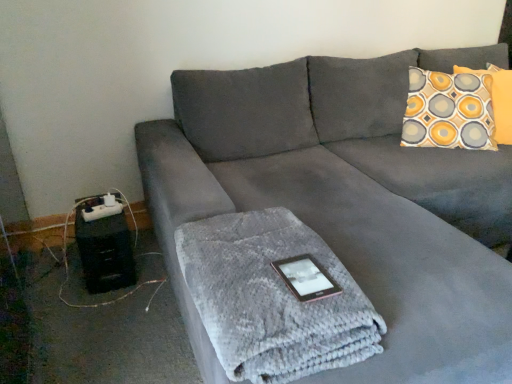
Question: Relative to pink glossy tablet at center, is yellow and gray patterned pillow at upper right in front or behind?

Choices:
 (A) front
 (B) behind

Answer: (B)

Question: From the image's perspective, is yellow and gray patterned pillow at upper right above or below pink glossy tablet at center?

Choices:
 (A) below
 (B) above

Answer: (B)

Question: Which object is the closest to the patterned fabric pillow at upper right?

Choices:
 (A) suede gray couch at center
 (B) yellow and gray patterned pillow at upper right
 (C) gray fluffy bath towel at center
 (D) pink glossy tablet at center

Answer: (B)

Question: Based on their relative distances, which object is nearer to the patterned fabric pillow at upper right?

Choices:
 (A) yellow and gray patterned pillow at upper right
 (B) pink glossy tablet at center
 (C) gray fluffy bath towel at center
 (D) suede gray couch at center

Answer: (A)